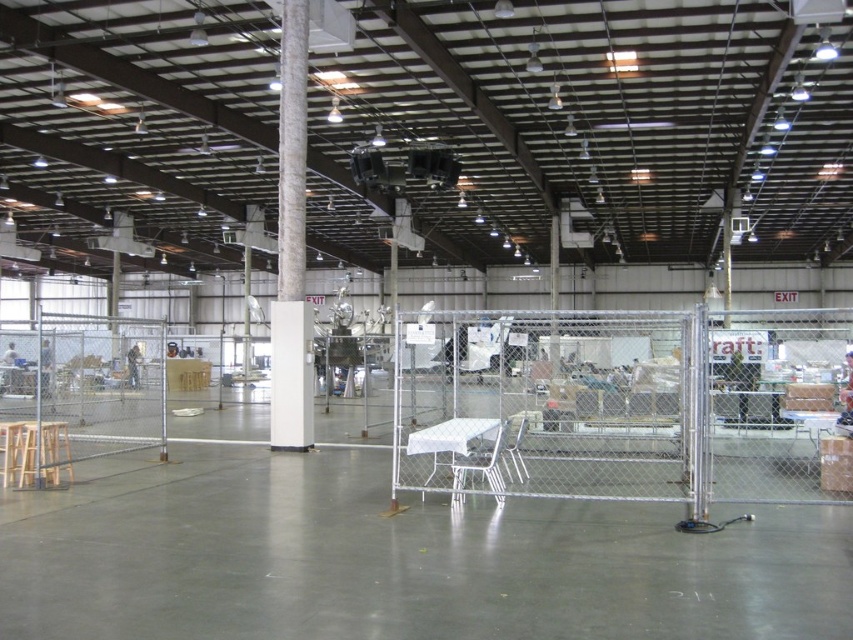
Does metallic chain-link fence at center have a lesser width compared to wooden stool at lower left?

No, metallic chain-link fence at center is not thinner than wooden stool at lower left.

Who is more forward, (12, 417) or (51, 472)?

Point (51, 472)

Where is `metallic chain-link fence at center`? This screenshot has height=640, width=853. metallic chain-link fence at center is located at coordinates (88, 384).

Does white textured column at center come behind metallic silver chair at center?

Yes, it is behind metallic silver chair at center.

Between white textured column at center and metallic silver chair at center, which one has more height?

white textured column at center

Which is behind, point (287, 72) or point (524, 468)?

Point (287, 72)

Locate an element on the screen. Image resolution: width=853 pixels, height=640 pixels. white textured column at center is located at coordinates (291, 248).

Is point (296, 308) more distant than point (10, 429)?

Yes, it is.

Between white textured column at center and light brown wooden stool at lower left, which one appears on the left side from the viewer's perspective?

light brown wooden stool at lower left is more to the left.

Between point (282, 243) and point (15, 436), which one is positioned behind?

Positioned behind is point (282, 243).

At what (x,y) coordinates should I click in order to perform the action: click on white textured column at center. Please return your answer as a coordinate pair (x, y). Looking at the image, I should click on (291, 248).